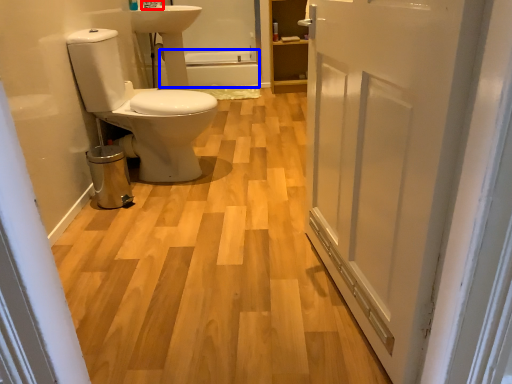
Question: Which object is closer to the camera taking this photo, tap (highlighted by a red box) or bath (highlighted by a blue box)?

Choices:
 (A) tap
 (B) bath

Answer: (A)